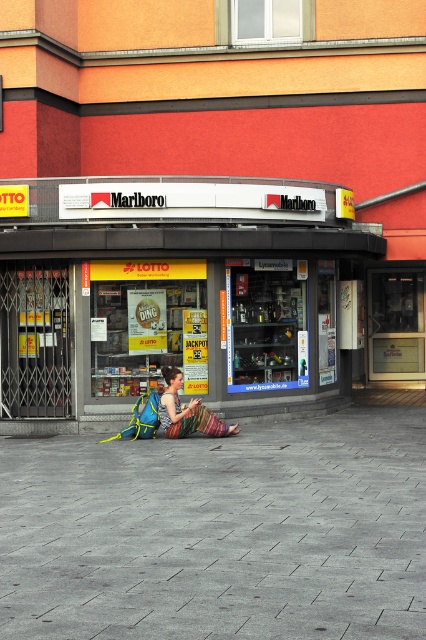
Is gray concrete pavement at lower center to the right of matte black store at center from the viewer's perspective?

Correct, you'll find gray concrete pavement at lower center to the right of matte black store at center.

This screenshot has width=426, height=640. Identify the location of gray concrete pavement at lower center. (218, 532).

Identify the location of gray concrete pavement at lower center. Image resolution: width=426 pixels, height=640 pixels. (218, 532).

Is point (348, 625) positioned in front of point (166, 417)?

That is True.

Can you confirm if gray concrete pavement at lower center is shorter than multicolored woven skirt at center?

Indeed, gray concrete pavement at lower center has a lesser height compared to multicolored woven skirt at center.

Is point (135, 456) closer to camera compared to point (233, 428)?

Yes.

I want to click on gray concrete pavement at lower center, so click(x=218, y=532).

Which is more to the right, matte black store at center or multicolored woven skirt at center?

multicolored woven skirt at center

Between matte black store at center and multicolored woven skirt at center, which one is positioned lower?

multicolored woven skirt at center is below.

Image resolution: width=426 pixels, height=640 pixels. Find the location of `matte black store at center`. matte black store at center is located at coordinates (170, 292).

This screenshot has width=426, height=640. I want to click on matte black store at center, so click(x=170, y=292).